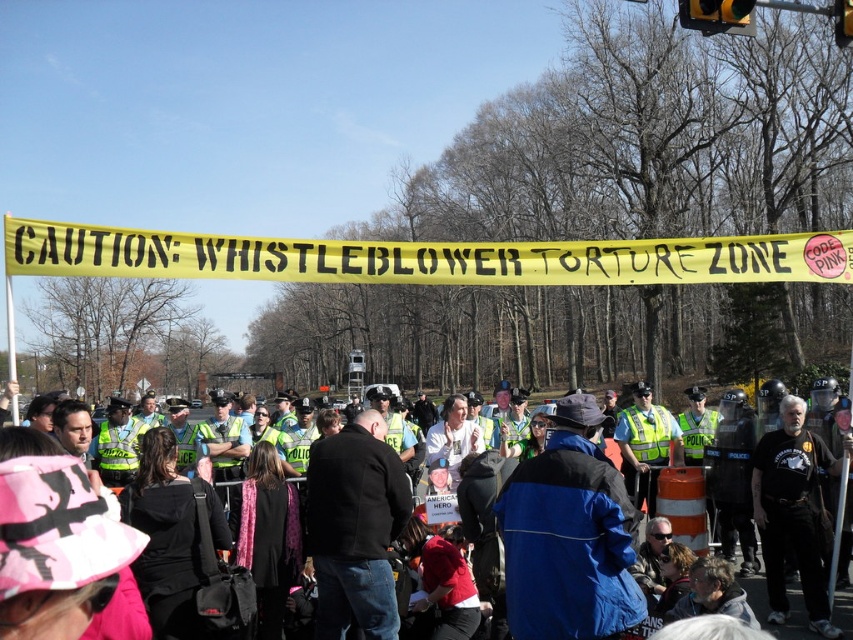
Which is more to the left, yellow caution tape at center or blue fabric jacket at center?

blue fabric jacket at center

Between point (619, 241) and point (548, 465), which one is positioned behind?

The point (619, 241) is more distant.

In order to click on yellow caution tape at center in this screenshot , I will do `click(422, 257)`.

Is blue fabric jacket at center below blue denim jacket at center?

Incorrect, blue fabric jacket at center is not positioned below blue denim jacket at center.

Does blue fabric jacket at center have a greater height compared to blue denim jacket at center?

Yes, blue fabric jacket at center is taller than blue denim jacket at center.

Which is in front, point (546, 627) or point (846, 593)?

Positioned in front is point (546, 627).

I want to click on blue fabric jacket at center, so click(x=569, y=536).

Who is positioned more to the left, yellow caution tape at center or blue denim jacket at center?

yellow caution tape at center

Does yellow caution tape at center appear under blue denim jacket at center?

Actually, yellow caution tape at center is above blue denim jacket at center.

Locate an element on the screen. yellow caution tape at center is located at coordinates 422,257.